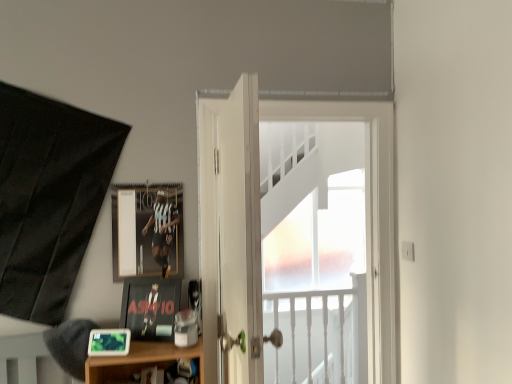
Describe the element at coordinates (282, 219) in the screenshot. I see `white glossy door at center, marked as the first door in a back-to-front arrangement` at that location.

Describe the element at coordinates (147, 230) in the screenshot. I see `metallic silver picture frame at upper left, which is the 3th picture frame from bottom to top` at that location.

In order to face matte black picture frame at lower left, which is the second picture frame from bottom to top, should I rotate leftwards or rightwards?

To align with it, rotate left about 13.472°.

What do you see at coordinates (240, 235) in the screenshot? The image size is (512, 384). I see `white wooden door at center, which is the 1th door from front to back` at bounding box center [240, 235].

Measure the distance between white wooden door at center, which is the 1th door from front to back, and camera.

They are 1.15 meters apart.

Identify the location of white glossy door at center, positioned as the second door in front-to-back order. The image size is (512, 384). (282, 219).

Which of these two, white wooden door at center, which is the 1th door from front to back, or white frosted glass at center, is wider?

Wider between the two is white wooden door at center, which is the 1th door from front to back.

Which object is closer to the camera taking this photo, white wooden door at center, positioned as the 2th door in back-to-front order, or white frosted glass at center?

white wooden door at center, positioned as the 2th door in back-to-front order.

From a real-world perspective, is white wooden door at center, positioned as the 2th door in back-to-front order, on white frosted glass at center?

Yes, from a real-world perspective, white wooden door at center, positioned as the 2th door in back-to-front order, is above white frosted glass at center.

Which door is the 2nd one when counting from the left side of the white frosted glass at center? Please provide its 2D coordinates.

[(240, 235)]

From the image's perspective, which door is the 1st one above the matte black picture frame at lower left, the second picture frame from the top? Please provide its 2D coordinates.

[(240, 235)]

Is matte black picture frame at lower left, the second picture frame from the top, at the back of white wooden door at center, positioned as the 2th door in back-to-front order?

No, white wooden door at center, positioned as the 2th door in back-to-front order,'s orientation is not away from matte black picture frame at lower left, the second picture frame from the top.

Considering the sizes of objects white wooden door at center, positioned as the 2th door in back-to-front order, and matte black picture frame at lower left, the second picture frame from the top, in the image provided, who is smaller, white wooden door at center, positioned as the 2th door in back-to-front order, or matte black picture frame at lower left, the second picture frame from the top,?

Smaller between the two is matte black picture frame at lower left, the second picture frame from the top.

From the image's perspective, is matte black picture frame at lower left, which is the second picture frame from bottom to top, located above white frosted glass at center?

Correct, matte black picture frame at lower left, which is the second picture frame from bottom to top, appears higher than white frosted glass at center in the image.

Can you confirm if matte black picture frame at lower left, the second picture frame from the top, is thinner than white frosted glass at center?

Incorrect, the width of matte black picture frame at lower left, the second picture frame from the top, is not less than that of white frosted glass at center.

Between matte black picture frame at lower left, marked as the 2th picture frame in a back-to-front arrangement, and white frosted glass at center, which one appears on the left side from the viewer's perspective?

Positioned to the left is matte black picture frame at lower left, marked as the 2th picture frame in a back-to-front arrangement.

Which is in front, point (169, 327) or point (292, 359)?

The point (169, 327) is in front.

Can you confirm if white glossy door at center, marked as the first door in a back-to-front arrangement, is positioned to the right of matte black picture frame at lower left, placed as the first picture frame when sorted from bottom to top?

Correct, you'll find white glossy door at center, marked as the first door in a back-to-front arrangement, to the right of matte black picture frame at lower left, placed as the first picture frame when sorted from bottom to top.

Measure the distance between white glossy door at center, positioned as the second door in front-to-back order, and matte black picture frame at lower left, which is the 1th picture frame from front to back.

white glossy door at center, positioned as the second door in front-to-back order, and matte black picture frame at lower left, which is the 1th picture frame from front to back, are 27.65 inches apart from each other.

In the scene shown: From a real-world perspective, is white glossy door at center, marked as the first door in a back-to-front arrangement, on matte black picture frame at lower left, placed as the first picture frame when sorted from bottom to top?

Correct, in the physical world, white glossy door at center, marked as the first door in a back-to-front arrangement, is higher than matte black picture frame at lower left, placed as the first picture frame when sorted from bottom to top.

Is white glossy door at center, marked as the first door in a back-to-front arrangement, further to camera compared to matte black picture frame at lower left, the third picture frame from the back?

Yes, it is.

From a real-world perspective, does metallic silver picture frame at upper left, which is the 3th picture frame from bottom to top, sit lower than white glossy door at center, marked as the first door in a back-to-front arrangement?

No, from a real-world perspective, metallic silver picture frame at upper left, which is the 3th picture frame from bottom to top, is not under white glossy door at center, marked as the first door in a back-to-front arrangement.

Is metallic silver picture frame at upper left, marked as the first picture frame in a top-to-bottom arrangement, oriented towards white glossy door at center, positioned as the second door in front-to-back order?

No, metallic silver picture frame at upper left, marked as the first picture frame in a top-to-bottom arrangement, is not facing towards white glossy door at center, positioned as the second door in front-to-back order.

From the image's perspective, who appears lower, metallic silver picture frame at upper left, the 1th picture frame in the back-to-front sequence, or white glossy door at center, marked as the first door in a back-to-front arrangement?

white glossy door at center, marked as the first door in a back-to-front arrangement, appears lower in the image.

From the image's perspective, is matte black picture frame at lower left, the second picture frame viewed from the front, located above or below white wooden door at center, positioned as the 2th door in back-to-front order?

Clearly, from the image's perspective, matte black picture frame at lower left, the second picture frame viewed from the front, is below white wooden door at center, positioned as the 2th door in back-to-front order.

How many degrees apart are the facing directions of matte black picture frame at lower left, the second picture frame from the top, and white wooden door at center, which is the 1th door from front to back?

The angle between the facing direction of matte black picture frame at lower left, the second picture frame from the top, and the facing direction of white wooden door at center, which is the 1th door from front to back, is 20.1 degrees.

Who is bigger, matte black picture frame at lower left, the second picture frame from the top, or white wooden door at center, positioned as the 2th door in back-to-front order?

With larger size is white wooden door at center, positioned as the 2th door in back-to-front order.

Considering the sizes of objects matte black picture frame at lower left, which is the second picture frame from bottom to top, and white wooden door at center, which is the 1th door from front to back, in the image provided, who is shorter, matte black picture frame at lower left, which is the second picture frame from bottom to top, or white wooden door at center, which is the 1th door from front to back,?

Standing shorter between the two is matte black picture frame at lower left, which is the second picture frame from bottom to top.

Considering the sizes of objects white frosted glass at center and metallic silver picture frame at upper left, the 1th picture frame in the back-to-front sequence, in the image provided, who is bigger, white frosted glass at center or metallic silver picture frame at upper left, the 1th picture frame in the back-to-front sequence,?

Bigger between the two is white frosted glass at center.

The width and height of the screenshot is (512, 384). What are the coordinates of `window that is below the metallic silver picture frame at upper left, marked as the first picture frame in a top-to-bottom arrangement (from the image's perspective)` in the screenshot? It's located at (314, 251).

Considering the positions of point (273, 128) and point (137, 263), is point (273, 128) closer or farther from the camera than point (137, 263)?

Point (273, 128) appears to be farther away from the viewer than point (137, 263).

Based on the photo, is metallic silver picture frame at upper left, marked as the first picture frame in a top-to-bottom arrangement, completely or partially inside white frosted glass at center?

No, metallic silver picture frame at upper left, marked as the first picture frame in a top-to-bottom arrangement, is not surrounded by white frosted glass at center.

Locate an element on the screen. The width and height of the screenshot is (512, 384). the 1st door above when counting from the white frosted glass at center (from the image's perspective) is located at coordinates (240, 235).

Which door is the 1st one when counting from the right side of the matte black picture frame at lower left, marked as the 2th picture frame in a back-to-front arrangement? Please provide its 2D coordinates.

[(240, 235)]

From the image, which object appears to be farther from metallic silver picture frame at upper left, which is the 3th picture frame from bottom to top, matte black picture frame at lower left, acting as the 3th picture frame starting from the top, or white glossy door at center, marked as the first door in a back-to-front arrangement?

Based on the image, matte black picture frame at lower left, acting as the 3th picture frame starting from the top, appears to be further to metallic silver picture frame at upper left, which is the 3th picture frame from bottom to top.

Which object lies further to the anchor point white wooden door at center, positioned as the 2th door in back-to-front order, white frosted glass at center or matte black picture frame at lower left, the third picture frame from the back?

white frosted glass at center is further to white wooden door at center, positioned as the 2th door in back-to-front order.

Consider the image. Based on their spatial positions, is white frosted glass at center or white wooden door at center, positioned as the 2th door in back-to-front order, further from metallic silver picture frame at upper left, the 1th picture frame in the back-to-front sequence?

Among the two, white frosted glass at center is located further to metallic silver picture frame at upper left, the 1th picture frame in the back-to-front sequence.

From the image, which object appears to be farther from white frosted glass at center, matte black picture frame at lower left, placed as the first picture frame when sorted from bottom to top, or white glossy door at center, marked as the first door in a back-to-front arrangement?

Based on the image, matte black picture frame at lower left, placed as the first picture frame when sorted from bottom to top, appears to be further to white frosted glass at center.

Looking at the image, which one is located further to white wooden door at center, which is the 1th door from front to back, white frosted glass at center or matte black picture frame at lower left, the second picture frame viewed from the front?

white frosted glass at center is further to white wooden door at center, which is the 1th door from front to back.

Looking at the image, which one is located further to white frosted glass at center, matte black picture frame at lower left, the second picture frame from the top, or matte black picture frame at lower left, which is the 1th picture frame from front to back?

matte black picture frame at lower left, which is the 1th picture frame from front to back.

From the image, which object appears to be farther from metallic silver picture frame at upper left, the 1th picture frame in the back-to-front sequence, white glossy door at center, positioned as the second door in front-to-back order, or white wooden door at center, positioned as the 2th door in back-to-front order?

Among the two, white wooden door at center, positioned as the 2th door in back-to-front order, is located further to metallic silver picture frame at upper left, the 1th picture frame in the back-to-front sequence.

Considering their positions, is white frosted glass at center positioned further to metallic silver picture frame at upper left, marked as the first picture frame in a top-to-bottom arrangement, than white glossy door at center, marked as the first door in a back-to-front arrangement?

Among the two, white frosted glass at center is located further to metallic silver picture frame at upper left, marked as the first picture frame in a top-to-bottom arrangement.

Locate an element on the screen. The height and width of the screenshot is (384, 512). picture frame between metallic silver picture frame at upper left, the 1th picture frame in the back-to-front sequence, and matte black picture frame at lower left, which is the 1th picture frame from front to back, vertically is located at coordinates (150, 307).

Find the location of a particular element. Image resolution: width=512 pixels, height=384 pixels. picture frame between metallic silver picture frame at upper left, marked as the first picture frame in a top-to-bottom arrangement, and white glossy door at center, positioned as the second door in front-to-back order, from left to right is located at coordinates [150, 307].

Find the location of a particular element. door between matte black picture frame at lower left, the third picture frame from the back, and white glossy door at center, positioned as the second door in front-to-back order, from left to right is located at coordinates (240, 235).

Where is `door positioned between white wooden door at center, which is the 1th door from front to back, and white frosted glass at center from near to far`? This screenshot has height=384, width=512. door positioned between white wooden door at center, which is the 1th door from front to back, and white frosted glass at center from near to far is located at coordinates (282, 219).